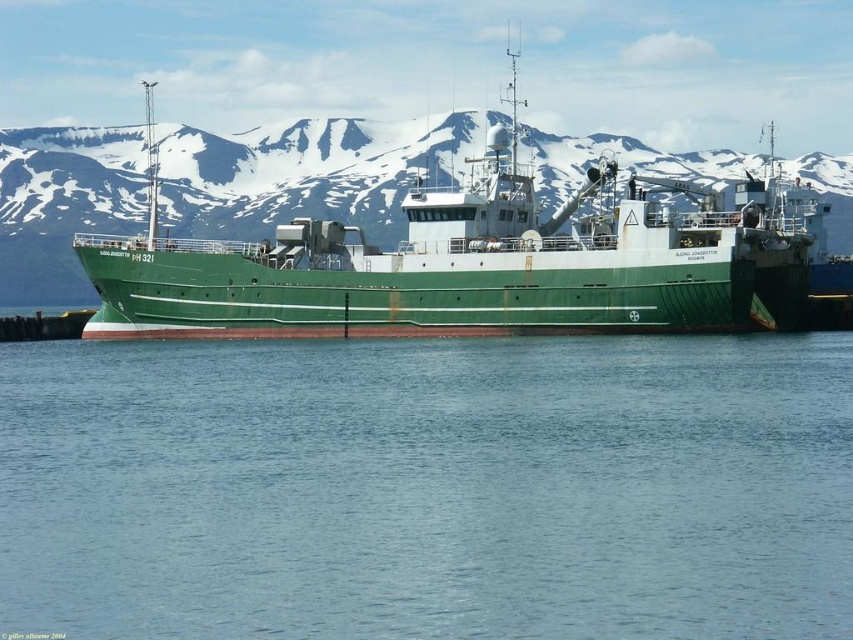
You are a marine biologist planning to board the green matte ship at center for a research trip. As you approach the dock, you notice the blue water at center nearby. Considering the spatial relationship between them, which one is narrower in width?

The blue water at center has a lesser width compared to the green matte ship at center, so the blue water at center is narrower.

You are a sailor on the green matte ship at center. You want to check the depth of the blue water at center near your ship. Based on the information provided, can you determine if the water is deeper or shallower than the height of your ship?

The blue water at center has a lesser height compared to the green matte ship at center, which means the water is shallower than the height of the ship.